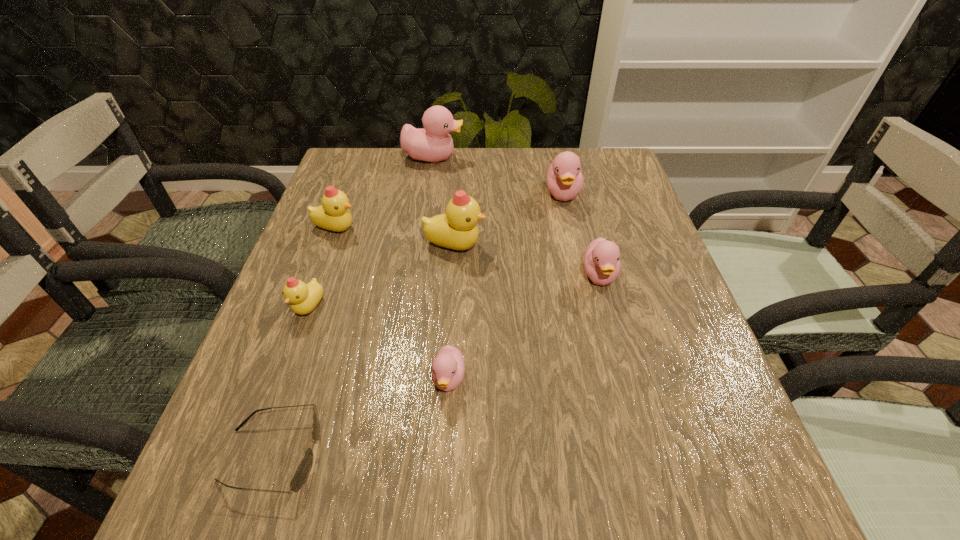
At what (x,y) coordinates should I click in order to perform the action: click on the shortest object. Please return your answer as a coordinate pair (x, y). The image size is (960, 540). Looking at the image, I should click on (304, 468).

The width and height of the screenshot is (960, 540). I want to click on sunglasses, so click(304, 468).

Where is `vacant space located on the front-facing side of the farthest object`? vacant space located on the front-facing side of the farthest object is located at coordinates (543, 158).

Where is `vacant space located on the front-facing side of the biggest yellow duckling`? This screenshot has width=960, height=540. vacant space located on the front-facing side of the biggest yellow duckling is located at coordinates (539, 246).

At what (x,y) coordinates should I click in order to perform the action: click on vacant space located on the front-facing side of the second farthest object. Please return your answer as a coordinate pair (x, y). Looking at the image, I should click on (583, 280).

Locate an element on the screen. The width and height of the screenshot is (960, 540). vacant space located 0.360m on the front-facing side of the second smallest yellow duckling is located at coordinates (512, 228).

Locate an element on the screen. This screenshot has width=960, height=540. vacant position located 0.360m on the front-facing side of the second nearest pink duckling is located at coordinates (656, 481).

The height and width of the screenshot is (540, 960). Find the location of `free space located on the front-facing side of the nearest yellow duckling`. free space located on the front-facing side of the nearest yellow duckling is located at coordinates (279, 389).

This screenshot has width=960, height=540. Find the location of `vacant space located on the front-facing side of the seventh tallest object`. vacant space located on the front-facing side of the seventh tallest object is located at coordinates (444, 471).

I want to click on vacant space located 0.350m on the front-facing side of the shortest object, so click(551, 455).